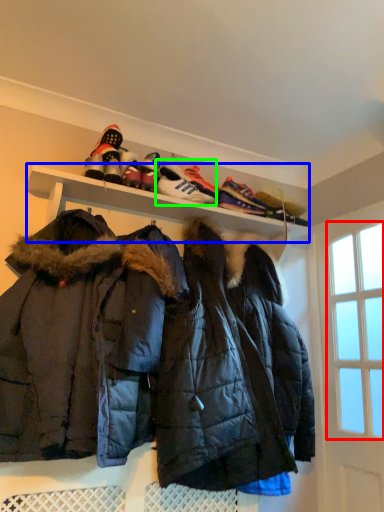
Question: Estimate the real-world distances between objects in this image. Which object is farther from window screen (highlighted by a red box), shelf (highlighted by a blue box) or footwear (highlighted by a green box)?

Choices:
 (A) shelf
 (B) footwear

Answer: (B)